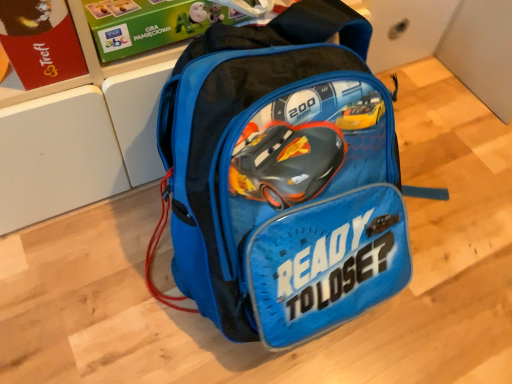
Identify the location of vacant region to the right of blue fabric backpack at center. Image resolution: width=512 pixels, height=384 pixels. (465, 229).